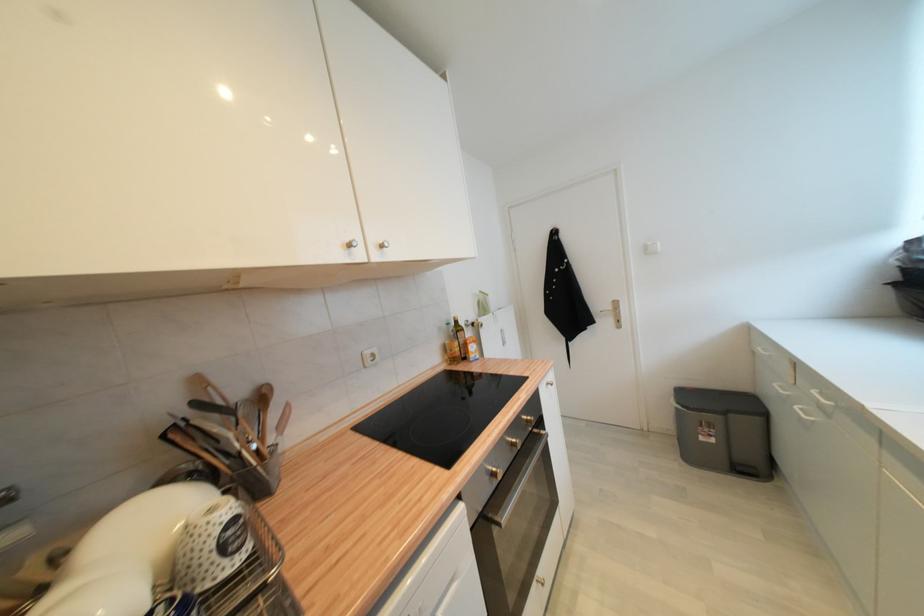
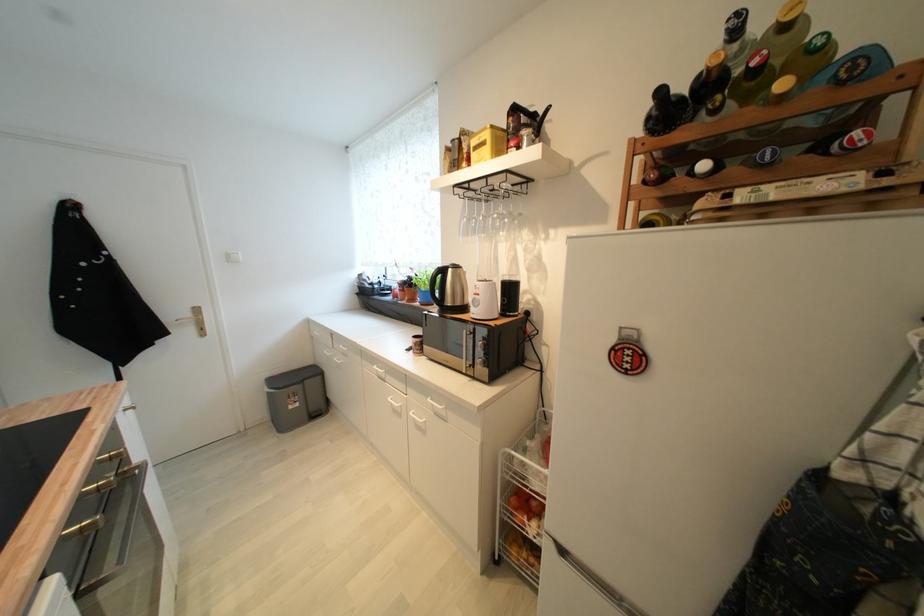
Question: The camera is either moving clockwise (left) or counter-clockwise (right) around the object. The first image is from the beginning of the video and the second image is from the end. Is the camera moving left or right when shooting the video?

Choices:
 (A) Left
 (B) Right

Answer: (A)